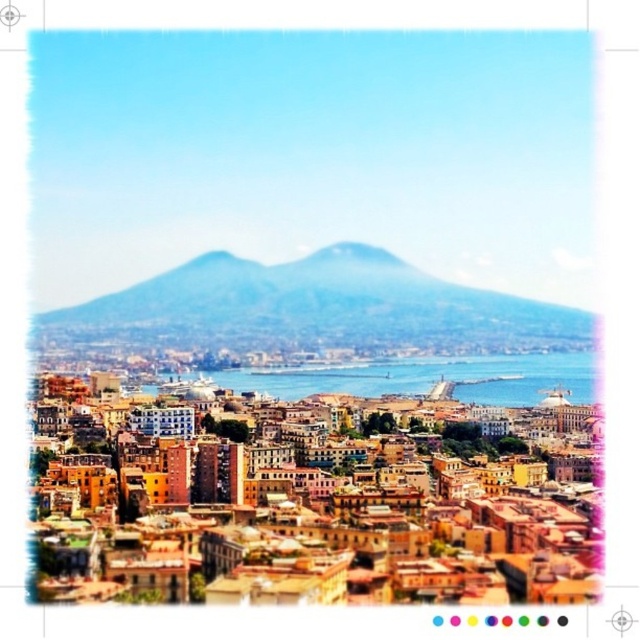
Question: Which of the following is the closest to the observer?

Choices:
 (A) blue water at center
 (B) blue foggy mountain at center

Answer: (A)

Question: Which point is farther to the camera?

Choices:
 (A) (237, 260)
 (B) (272, 374)

Answer: (A)

Question: Is blue foggy mountain at center bigger than blue water at center?

Choices:
 (A) yes
 (B) no

Answer: (A)

Question: Is blue foggy mountain at center smaller than blue water at center?

Choices:
 (A) no
 (B) yes

Answer: (A)

Question: Does blue foggy mountain at center appear over blue water at center?

Choices:
 (A) no
 (B) yes

Answer: (B)